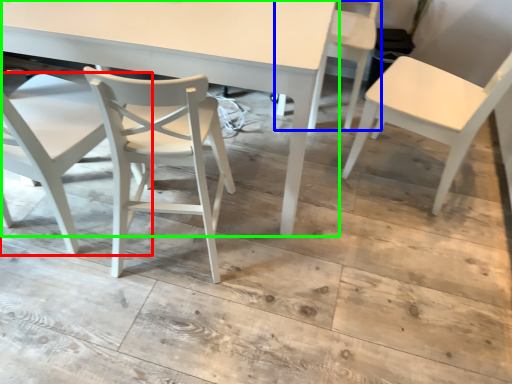
Question: Which object is positioned closest to chair (highlighted by a red box)? Select from chair (highlighted by a blue box) and table (highlighted by a green box).

Choices:
 (A) chair
 (B) table

Answer: (B)